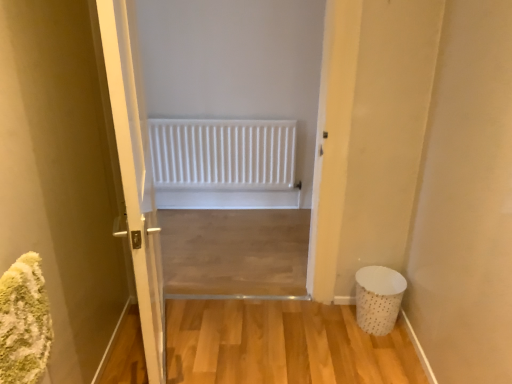
Where is `vacant space to the left of white dotted fabric laundry basket at lower right`? The width and height of the screenshot is (512, 384). vacant space to the left of white dotted fabric laundry basket at lower right is located at coordinates (337, 317).